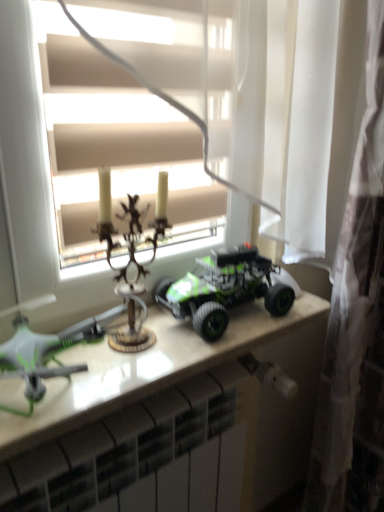
Question: Visually, is green matte drone at left, which ranks as the third toy in right-to-left order, positioned to the left or to the right of matte white window at center?

Choices:
 (A) left
 (B) right

Answer: (A)

Question: Considering the positions of green matte drone at left, which ranks as the third toy in right-to-left order, and matte white window at center in the image, is green matte drone at left, which ranks as the third toy in right-to-left order, bigger or smaller than matte white window at center?

Choices:
 (A) small
 (B) big

Answer: (A)

Question: Considering the real-world distances, which object is closest to the white glossy table at center?

Choices:
 (A) white sheer curtain at right
 (B) white glossy radiator at lower center
 (C) green matte toy truck at center, the first toy positioned from the right
 (D) antique brass candlestick at center, marked as the 2th toy in a left-to-right arrangement
 (E) matte white window at center

Answer: (C)

Question: Estimate the real-world distances between objects in this image. Which object is farther from the white sheer curtain at right?

Choices:
 (A) green matte toy truck at center, positioned as the 3th toy in left-to-right order
 (B) white glossy table at center
 (C) matte white window at center
 (D) antique brass candlestick at center, marked as the 2th toy in a left-to-right arrangement
 (E) green matte drone at left, which ranks as the third toy in right-to-left order

Answer: (E)